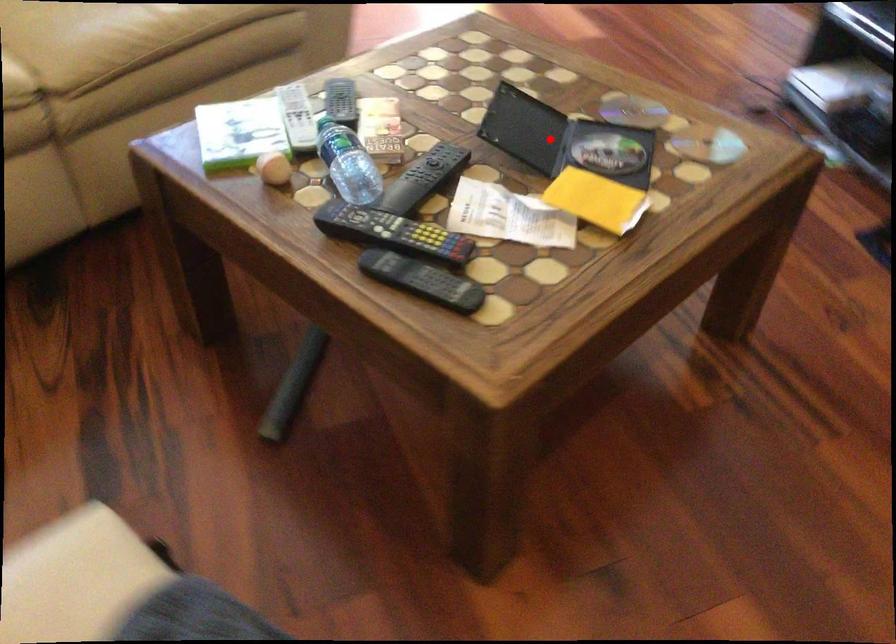
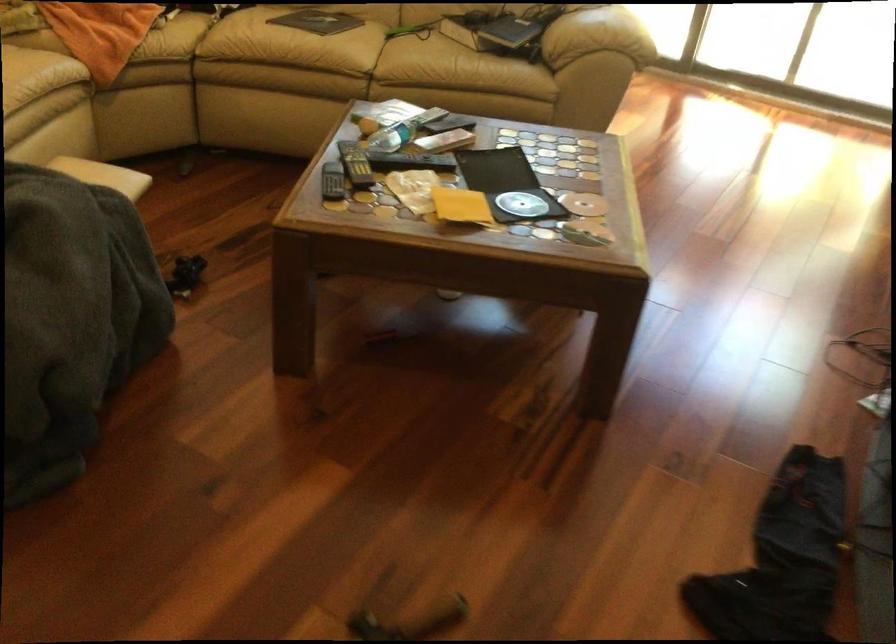
Question: A red point is marked in image1. In image2, is the corresponding 3D point closer to the camera or farther? Reply with the corresponding letter.

Choices:
 (A) The corresponding 3D point is closer.
 (B) The corresponding 3D point is farther.

Answer: (B)